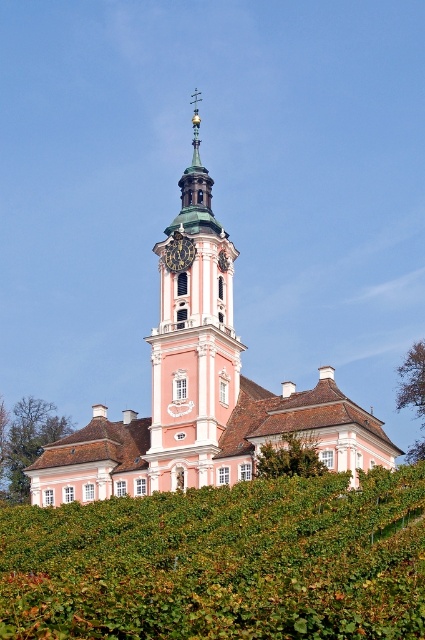
You are standing in the garden and see the green leafy hedge at lower center and the pink stucco tower at center. Which object is closer to the ground?

The green leafy hedge at lower center is closer to the ground since it is located below the pink stucco tower at center.